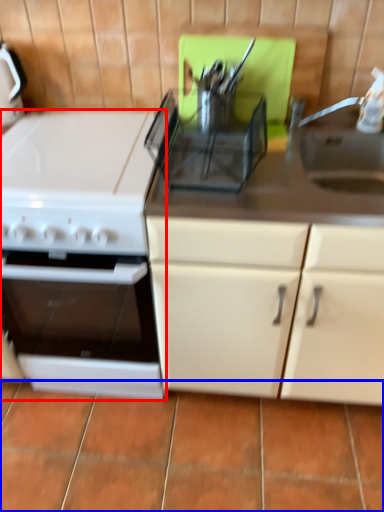
Question: Which object appears farthest to the camera in this image, kitchen appliance (highlighted by a red box) or tile (highlighted by a blue box)?

Choices:
 (A) kitchen appliance
 (B) tile

Answer: (B)